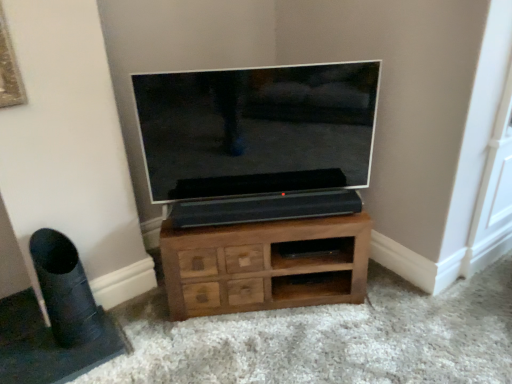
This screenshot has height=384, width=512. I want to click on free space that is to the left of black matte speaker at lower left, so click(26, 349).